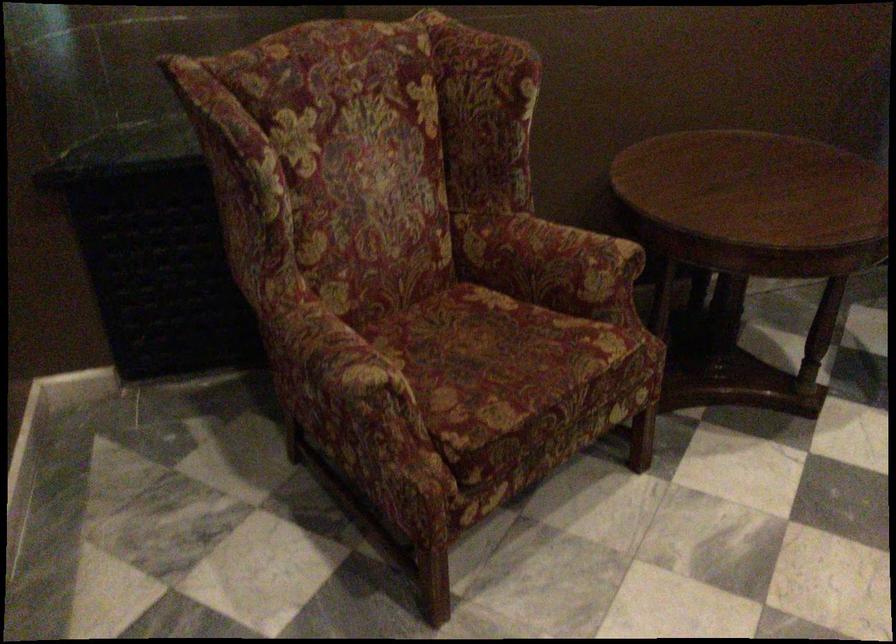
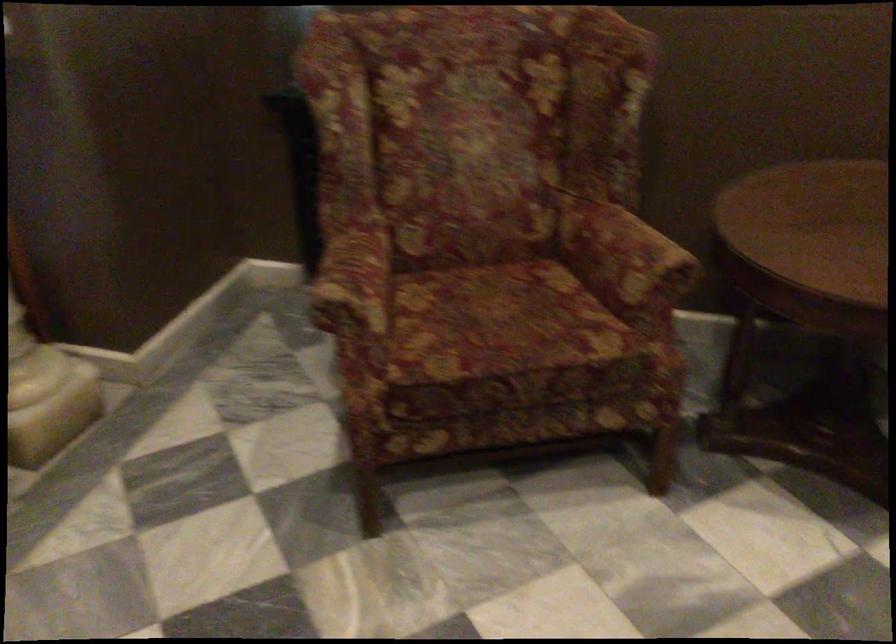
Where in the second image is the point corresponding to point 380,362 from the first image?

(355, 286)